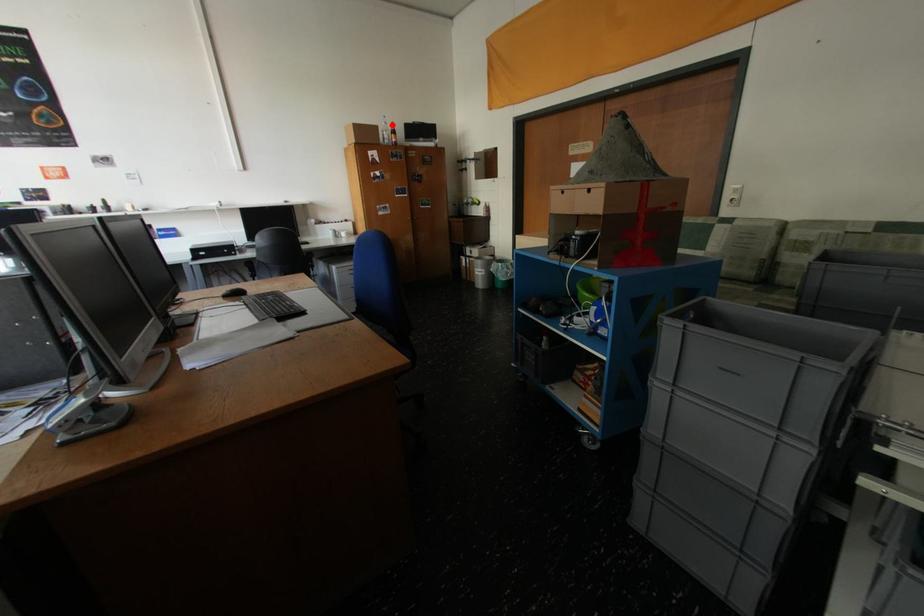
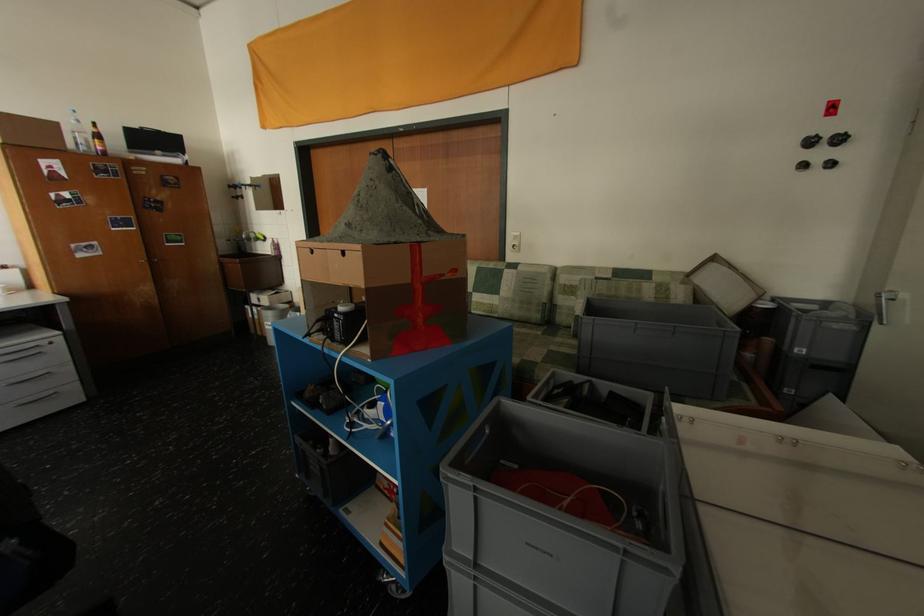
Question: I am providing you with two images of the same scene from different viewpoints. In image1, a red point is highlighted. Considering the same 3D point in image2, which of the following is correct?

Choices:
 (A) It is closer
 (B) It is farther

Answer: (B)